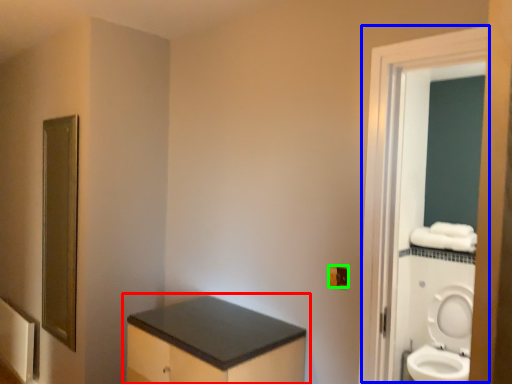
Question: Based on their relative distances, which object is nearer to bathroom cabinet (highlighted by a red box)? Choose from screen door (highlighted by a blue box) and electric outlet (highlighted by a green box).

Choices:
 (A) screen door
 (B) electric outlet

Answer: (B)